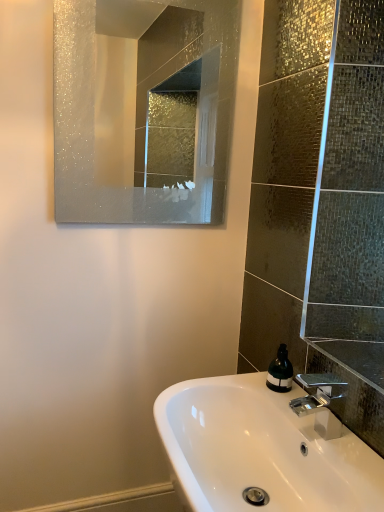
Find the location of a particular element. This screenshot has height=512, width=384. vacant area in front of green matte soap dispenser at lower right is located at coordinates (297, 411).